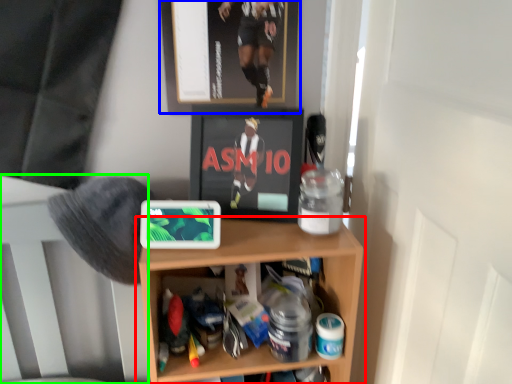
Question: Based on their relative distances, which object is nearer to shelf (highlighted by a red box)? Choose from picture frame (highlighted by a blue box) and bed frame (highlighted by a green box).

Choices:
 (A) picture frame
 (B) bed frame

Answer: (B)